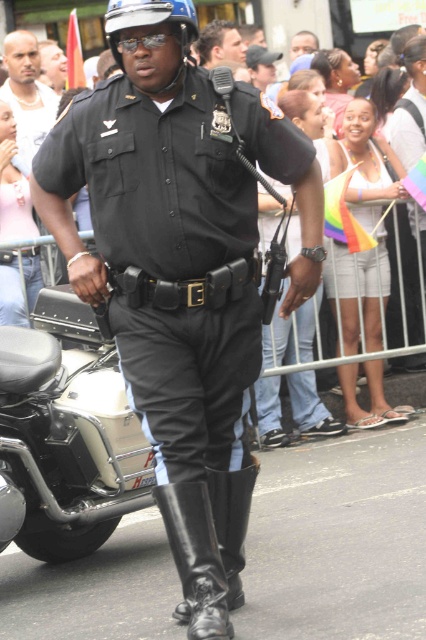
Question: Does black leather boot at lower center come behind smooth skin at center?

Choices:
 (A) yes
 (B) no

Answer: (B)

Question: Estimate the real-world distances between objects in this image. Which object is farther from the black leather boot at center?

Choices:
 (A) smooth skin face at upper left
 (B) matte black uniform at center

Answer: (A)

Question: Does black leather boot at center have a lesser width compared to black leather boot at lower center?

Choices:
 (A) no
 (B) yes

Answer: (A)

Question: Based on their relative distances, which object is farther from the matte black uniform at center?

Choices:
 (A) black leather boot at lower center
 (B) black leather boot at center
 (C) smooth skin face at upper left
 (D) smooth skin at center

Answer: (D)

Question: Can you confirm if smooth skin face at upper left is positioned to the left of smooth skin at center?

Choices:
 (A) yes
 (B) no

Answer: (A)

Question: Which point appears farthest from the camera in this image?

Choices:
 (A) (230, 51)
 (B) (236, 515)
 (C) (186, 572)
 (D) (28, 141)

Answer: (A)